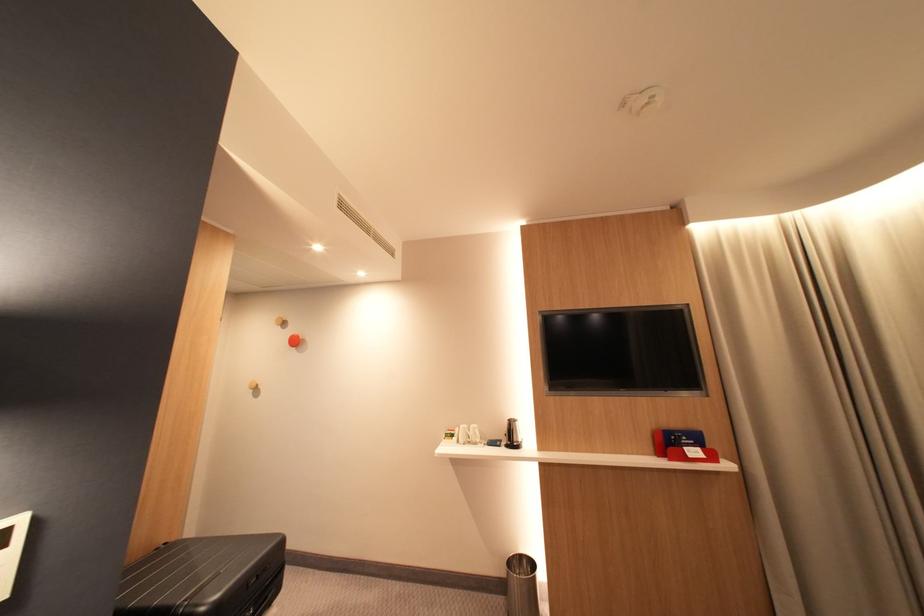
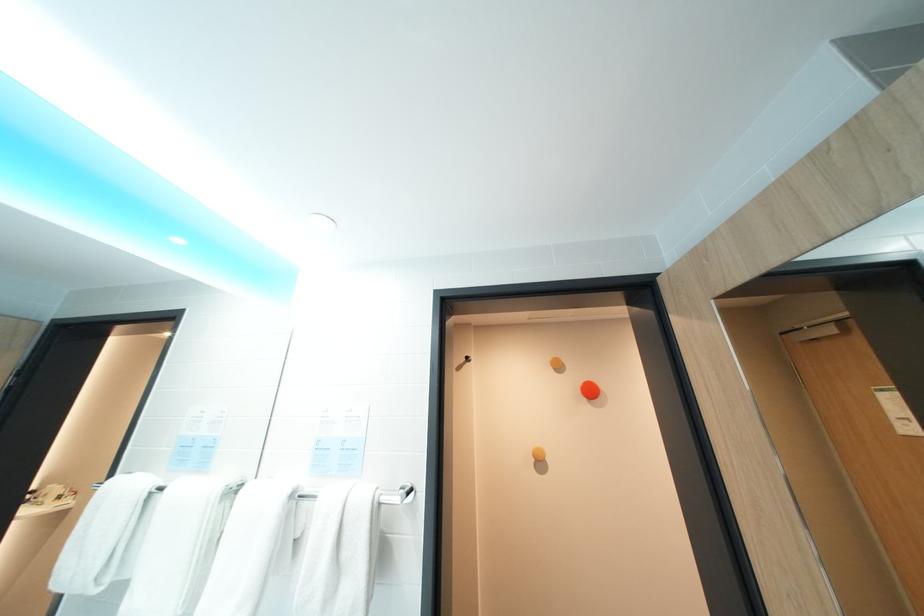
Question: Which direction would the cameraman need to move to produce the second image? Reply with the corresponding letter.

Choices:
 (A) Left
 (B) Right
 (C) Forward
 (D) Backward

Answer: (A)